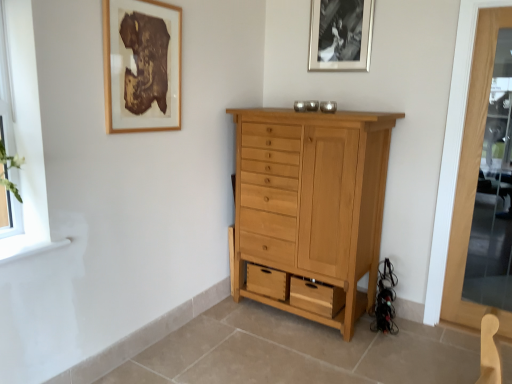
Question: Can you confirm if clear glass window at left is wider than wooden picture frame at upper left, positioned as the 1th picture frame in left-to-right order?

Choices:
 (A) no
 (B) yes

Answer: (B)

Question: Is clear glass window at left bigger than wooden picture frame at upper left, which appears as the 2th picture frame when viewed from the back?

Choices:
 (A) no
 (B) yes

Answer: (A)

Question: Would you say wooden picture frame at upper left, which appears as the 2th picture frame when viewed from the back, is part of clear glass window at left's contents?

Choices:
 (A) no
 (B) yes

Answer: (A)

Question: Is clear glass window at left not within wooden picture frame at upper left, which appears as the 2th picture frame when viewed from the back?

Choices:
 (A) no
 (B) yes

Answer: (B)

Question: Is clear glass window at left with wooden picture frame at upper left, which appears as the 2th picture frame when viewed from the back?

Choices:
 (A) yes
 (B) no

Answer: (B)

Question: Is the depth of clear glass window at left greater than that of wooden picture frame at upper left, placed as the 2th picture frame when sorted from right to left?

Choices:
 (A) yes
 (B) no

Answer: (B)

Question: Considering the relative positions of natural wood cabinet at center and clear glass window at left in the image provided, is natural wood cabinet at center behind clear glass window at left?

Choices:
 (A) no
 (B) yes

Answer: (B)

Question: Is natural wood cabinet at center looking in the opposite direction of clear glass window at left?

Choices:
 (A) no
 (B) yes

Answer: (A)

Question: Does natural wood cabinet at center have a lesser width compared to clear glass window at left?

Choices:
 (A) yes
 (B) no

Answer: (B)

Question: Can we say natural wood cabinet at center lies outside clear glass window at left?

Choices:
 (A) yes
 (B) no

Answer: (A)

Question: From the image's perspective, is natural wood cabinet at center on clear glass window at left?

Choices:
 (A) no
 (B) yes

Answer: (A)

Question: From the image's perspective, would you say natural wood cabinet at center is shown under clear glass window at left?

Choices:
 (A) no
 (B) yes

Answer: (B)

Question: Can transparent glass screen door at right be found inside wooden picture frame at upper left, the 1th picture frame when ordered from front to back?

Choices:
 (A) no
 (B) yes

Answer: (A)